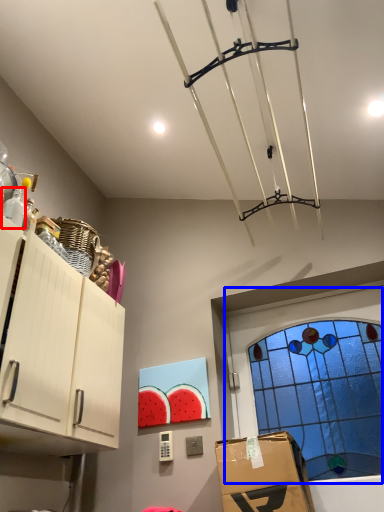
Question: Which object appears farthest to the camera in this image, bottle (highlighted by a red box) or window (highlighted by a blue box)?

Choices:
 (A) bottle
 (B) window

Answer: (B)